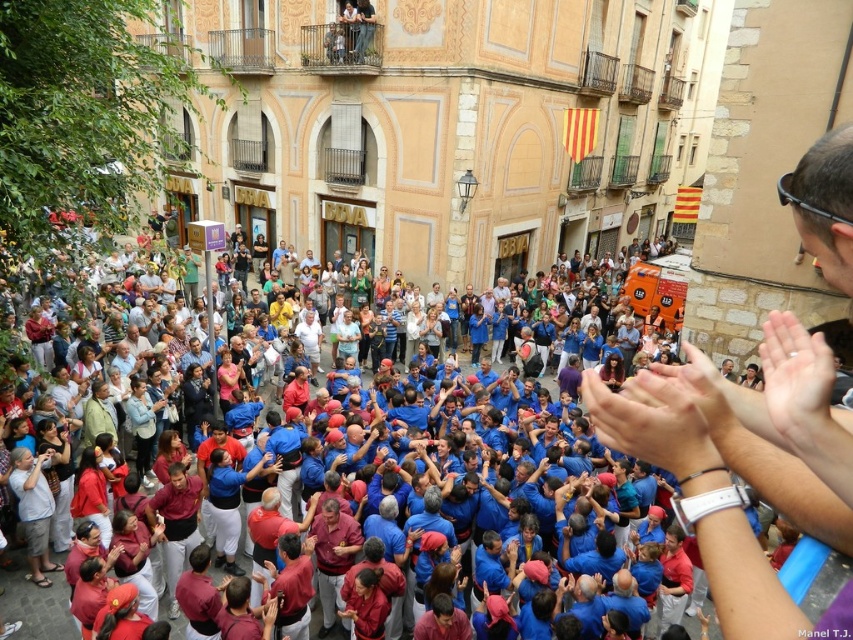
You are a photographer standing at the center of the street. You want to capture a photo of the human pyramid formed by the people in red shirts. However, there is a matte black watch at upper right that might obstruct your view. Based on its coordinates, will the watch block your shot of the human pyramid?

The matte black watch at upper right is located at coordinates point (740, 464), which is in the upper right corner of the image. Since the human pyramid is in the middle of the street, the watch will not block your view of the human pyramid.

You are a photographer standing on the street and want to take a photo of the blue fabric crowd at center without including the matte black watch at upper right. Is this possible given their positions?

The matte black watch at upper right is located above the blue fabric crowd at center, so if you position yourself lower or adjust your angle to avoid looking upward, you can capture the blue fabric crowd at center without including the matte black watch at upper right.